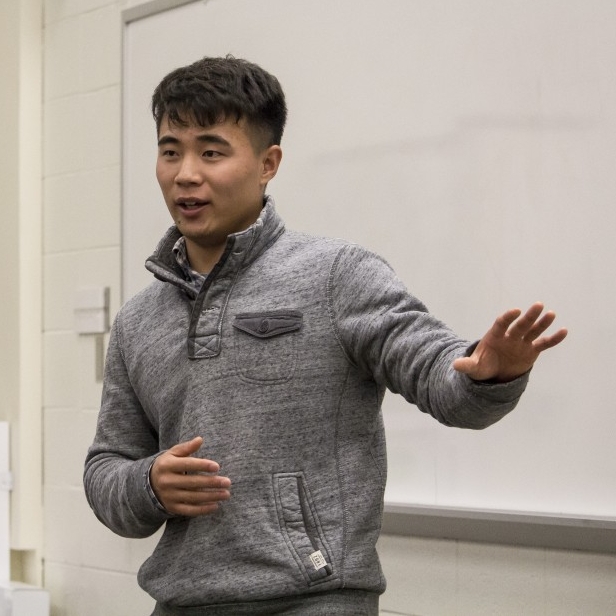
Find the location of a particular element. cement wall is located at coordinates (71, 124), (82, 205), (70, 249), (55, 329), (67, 382).